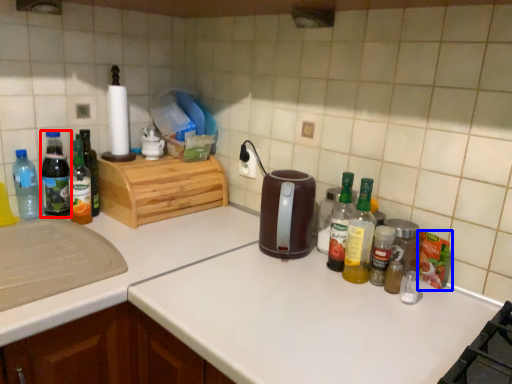
Question: Which object is further to the camera taking this photo, bottle (highlighted by a red box) or food (highlighted by a blue box)?

Choices:
 (A) bottle
 (B) food

Answer: (A)